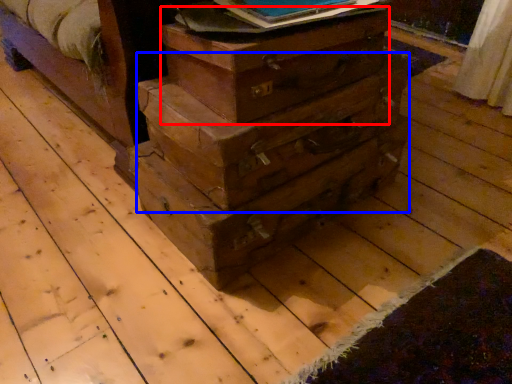
Question: Which point is closer to the camera, crate (highlighted by a red box) or drawer (highlighted by a blue box)?

Choices:
 (A) crate
 (B) drawer

Answer: (A)